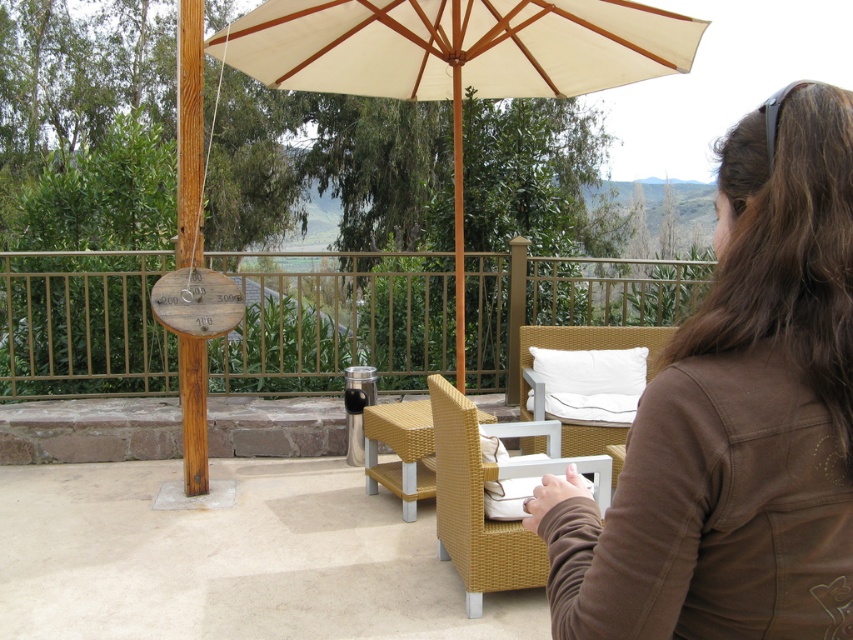
You are standing at the entrance of the patio and want to sit down on the white wicker chair at center. Which direction should you walk to reach it?

The white wicker chair at center is located at point coordinates, so you should walk towards the center of the patio to reach it.

You are standing on the patio and see the point marked at coordinates [735,417]. What object is this point located on?

The point at coordinates [735,417] is located on the brown cotton jacket at upper right.

You are sitting on the woven rattan chair at center and want to hand an item to someone sitting on the white wicker chair at center. In which direction should you pass the item?

You should pass the item to the right since the white wicker chair at center is to the right of the woven rattan chair at center.